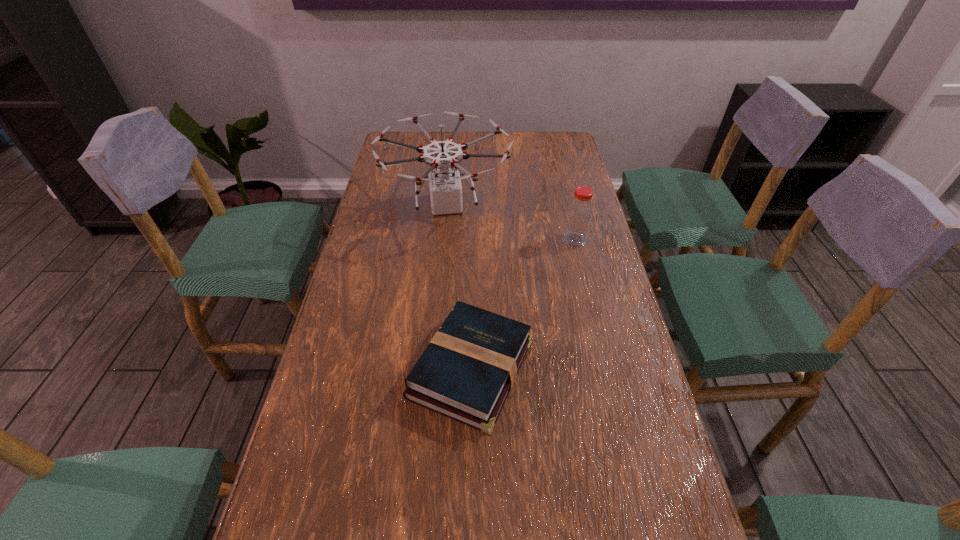
In the image, there is a desktop. Where is `free space at the far edge`? free space at the far edge is located at coordinates (522, 131).

You are a GUI agent. You are given a task and a screenshot of the screen. Output one action in this format:
    pyautogui.click(x=<x>, y=<y>)
    Task: Click on the vacant space at the left edge of the desktop
    
    Given the screenshot: What is the action you would take?
    pyautogui.click(x=358, y=283)

The width and height of the screenshot is (960, 540). In the image, there is a desktop. What are the coordinates of `vacant space at the right edge` in the screenshot? It's located at (566, 185).

You are a GUI agent. You are given a task and a screenshot of the screen. Output one action in this format:
    pyautogui.click(x=<x>, y=<y>)
    Task: Click on the vacant space at the far right corner
    
    Given the screenshot: What is the action you would take?
    pyautogui.click(x=548, y=140)

The image size is (960, 540). Find the location of `free space between the drone and the hardback book`. free space between the drone and the hardback book is located at coordinates (459, 287).

Image resolution: width=960 pixels, height=540 pixels. I want to click on free space that is in between the drone and the hardback book, so click(459, 287).

You are a GUI agent. You are given a task and a screenshot of the screen. Output one action in this format:
    pyautogui.click(x=<x>, y=<y>)
    Task: Click on the free point between the second shortest object and the shortest object
    This screenshot has width=960, height=540.
    Given the screenshot: What is the action you would take?
    pyautogui.click(x=523, y=305)

The height and width of the screenshot is (540, 960). I want to click on empty location between the second shortest object and the nearest object, so click(x=523, y=305).

I want to click on free space between the rightmost object and the hardback book, so click(523, 305).

Identify which object is located as the nearest to the hardback book. Please provide its 2D coordinates. Your answer should be formatted as a tuple, i.e. [(x, y)], where the tuple contains the x and y coordinates of a point satisfying the conditions above.

[(445, 185)]